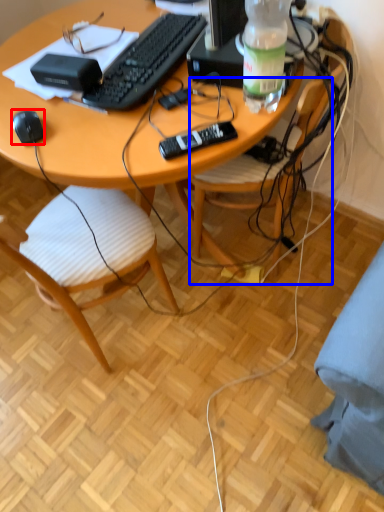
Question: Among these objects, which one is nearest to the camera, computer mouse (highlighted by a red box) or chair (highlighted by a blue box)?

Choices:
 (A) computer mouse
 (B) chair

Answer: (B)